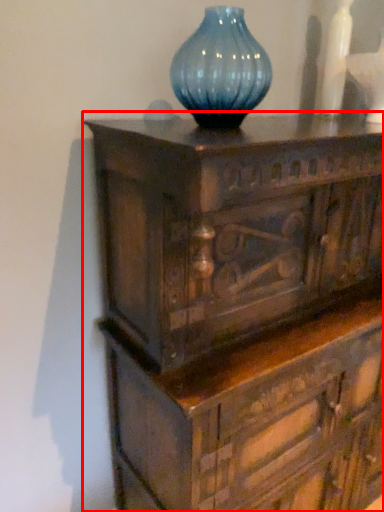
Question: In this image, where is chest of drawers (annotated by the red box) located relative to vase?

Choices:
 (A) left
 (B) right

Answer: (B)